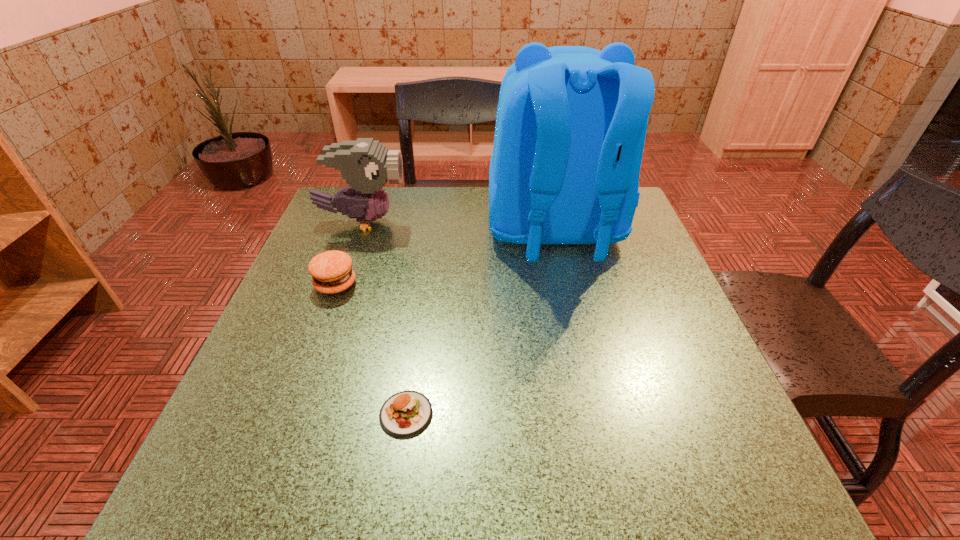
The height and width of the screenshot is (540, 960). What are the coordinates of `vacant point at the left edge` in the screenshot? It's located at (358, 301).

This screenshot has height=540, width=960. Identify the location of free space at the right edge of the desktop. (693, 353).

Image resolution: width=960 pixels, height=540 pixels. In order to click on free space at the near right corner of the desktop in this screenshot , I will do `click(742, 451)`.

Locate an element on the screen. This screenshot has width=960, height=540. free space between the backpack and the nearer patty (food) is located at coordinates (481, 323).

Identify the location of vacant space that's between the farther patty (food) and the backpack. The height and width of the screenshot is (540, 960). (445, 258).

What are the coordinates of `free space between the right patty (food) and the rightmost object` in the screenshot? It's located at (481, 323).

Locate an element on the screen. The height and width of the screenshot is (540, 960). free space between the third shortest object and the tallest object is located at coordinates (459, 227).

This screenshot has height=540, width=960. I want to click on vacant space that is in between the backpack and the left patty (food), so click(445, 258).

Locate an element on the screen. The height and width of the screenshot is (540, 960). free space between the bird and the backpack is located at coordinates (459, 227).

Locate an element on the screen. vacant area between the taller patty (food) and the tallest object is located at coordinates (445, 258).